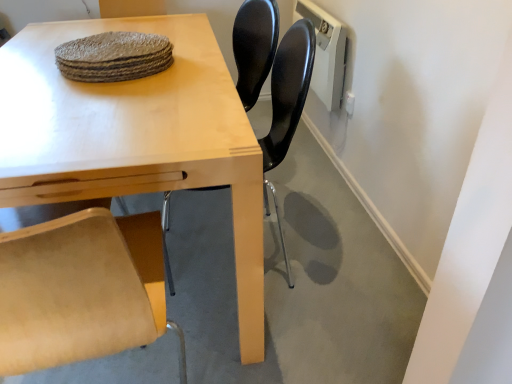
Identify the location of black plastic chair at center. (288, 90).

You are a GUI agent. You are given a task and a screenshot of the screen. Output one action in this format:
    pyautogui.click(x=<x>, y=<y>)
    Task: Click on the light wood table at center
    The width and height of the screenshot is (512, 384).
    Given the screenshot: What is the action you would take?
    pyautogui.click(x=295, y=283)

From the picture: Measure the distance between light wood table at center and camera.

They are 3.90 feet apart.

This screenshot has height=384, width=512. What are the coordinates of `black plastic chair at center` in the screenshot? It's located at (288, 90).

From the image's perspective, is light wood table at center located above light wood table at center?

No, from the image's perspective, light wood table at center is not on top of light wood table at center.

Measure the distance between light wood table at center and light wood table at center.

light wood table at center and light wood table at center are 22.86 inches apart from each other.

Considering the positions of objects light wood table at center and light wood table at center in the image provided, who is behind, light wood table at center or light wood table at center?

light wood table at center is further from the camera.

Considering the relative sizes of light wood table at center and light wood table at center in the image provided, is light wood table at center bigger than light wood table at center?

No, light wood table at center is not bigger than light wood table at center.

Does light wood table at center have a lesser height compared to black plastic chair at center?

Yes, light wood table at center is shorter than black plastic chair at center.

Considering the relative sizes of light wood table at center and black plastic chair at center in the image provided, is light wood table at center wider than black plastic chair at center?

Yes.

Can you confirm if light wood table at center is bigger than black plastic chair at center?

Actually, light wood table at center might be smaller than black plastic chair at center.

Is light wood table at center not within black plastic chair at center?

Yes, light wood table at center is outside of black plastic chair at center.

Is light wood table at center taller than rough woven placemat at upper center?

In fact, light wood table at center may be shorter than rough woven placemat at upper center.

From the image's perspective, would you say light wood table at center is positioned over rough woven placemat at upper center?

Incorrect, from the image's perspective, light wood table at center is lower than rough woven placemat at upper center.

Is there a large distance between light wood table at center and rough woven placemat at upper center?

No, light wood table at center is not far away from rough woven placemat at upper center.

From a real-world perspective, which is physically above, light wood table at center or rough woven placemat at upper center?

rough woven placemat at upper center, from a real-world perspective.

Between black plastic chair at center and light wood table at center, which one has less height?

light wood table at center is shorter.

Would you say black plastic chair at center is a long distance from light wood table at center?

black plastic chair at center is near light wood table at center, not far away.

How different are the orientations of black plastic chair at center and light wood table at center in degrees?

black plastic chair at center and light wood table at center are facing 1.82 degrees away from each other.

From a real-world perspective, who is located higher, black plastic chair at center or light wood table at center?

In real-world perspective, black plastic chair at center is above.

Can you tell me how much light wood table at center and light wood table at center differ in facing direction?

The angular difference between light wood table at center and light wood table at center is 90.3 degrees.

This screenshot has width=512, height=384. What are the coordinates of `concrete below the light wood table at center (from the image's perspective)` in the screenshot? It's located at (295, 283).

From the image's perspective, which is below, light wood table at center or light wood table at center?

From the image's view, light wood table at center is below.

Are light wood table at center and light wood table at center far apart?

Actually, light wood table at center and light wood table at center are a little close together.

Is black plastic chair at center to the left of light wood table at center from the viewer's perspective?

Incorrect, black plastic chair at center is not on the left side of light wood table at center.

Is black plastic chair at center situated inside light wood table at center or outside?

black plastic chair at center cannot be found inside light wood table at center.

From the image's perspective, which one is positioned lower, black plastic chair at center or light wood table at center?

light wood table at center appears lower in the image.

Between light wood table at center and rough woven placemat at upper center, which one has less height?

rough woven placemat at upper center.

Is light wood table at center positioned with its back to rough woven placemat at upper center?

No.

Find the location of `food behind the light wood table at center`. food behind the light wood table at center is located at coordinates (114, 57).

From a real-world perspective, is light wood table at center positioned under rough woven placemat at upper center based on gravity?

Yes, from a real-world perspective, light wood table at center is under rough woven placemat at upper center.

The height and width of the screenshot is (384, 512). What are the coordinates of `concrete below the light wood table at center (from a real-world perspective)` in the screenshot? It's located at (295, 283).

Locate an element on the screen. Image resolution: width=512 pixels, height=384 pixels. chair to the right of light wood table at center is located at coordinates (288, 90).

Which object lies further to the anchor point light wood table at center, black plastic chair at center or rough woven placemat at upper center?

black plastic chair at center lies further to light wood table at center than the other object.

Considering their positions, is rough woven placemat at upper center positioned closer to light wood table at center than black plastic chair at center?

rough woven placemat at upper center is closer to light wood table at center.

When comparing their distances from light wood table at center, does rough woven placemat at upper center or black plastic chair at center seem further?

rough woven placemat at upper center lies further to light wood table at center than the other object.

Based on their spatial positions, is black plastic chair at center or light wood table at center closer to rough woven placemat at upper center?

light wood table at center.

Considering their positions, is rough woven placemat at upper center positioned closer to light wood table at center than light wood table at center?

rough woven placemat at upper center lies closer to light wood table at center than the other object.

Estimate the real-world distances between objects in this image. Which object is closer to light wood table at center, rough woven placemat at upper center or light wood table at center?

light wood table at center.

Which object lies further to the anchor point rough woven placemat at upper center, light wood table at center or black plastic chair at center?

The object further to rough woven placemat at upper center is black plastic chair at center.

From the image, which object appears to be nearer to black plastic chair at center, rough woven placemat at upper center or light wood table at center?

light wood table at center lies closer to black plastic chair at center than the other object.

Find the location of a particular element. This screenshot has width=512, height=384. food located between light wood table at center and black plastic chair at center in the left-right direction is located at coordinates (114, 57).

Where is `table between rough woven placemat at upper center and light wood table at center from top to bottom`? The width and height of the screenshot is (512, 384). table between rough woven placemat at upper center and light wood table at center from top to bottom is located at coordinates (135, 136).

Where is `concrete between light wood table at center and black plastic chair at center from left to right`? Image resolution: width=512 pixels, height=384 pixels. concrete between light wood table at center and black plastic chair at center from left to right is located at coordinates (295, 283).

Image resolution: width=512 pixels, height=384 pixels. Identify the location of chair between rough woven placemat at upper center and light wood table at center in the vertical direction. (288, 90).